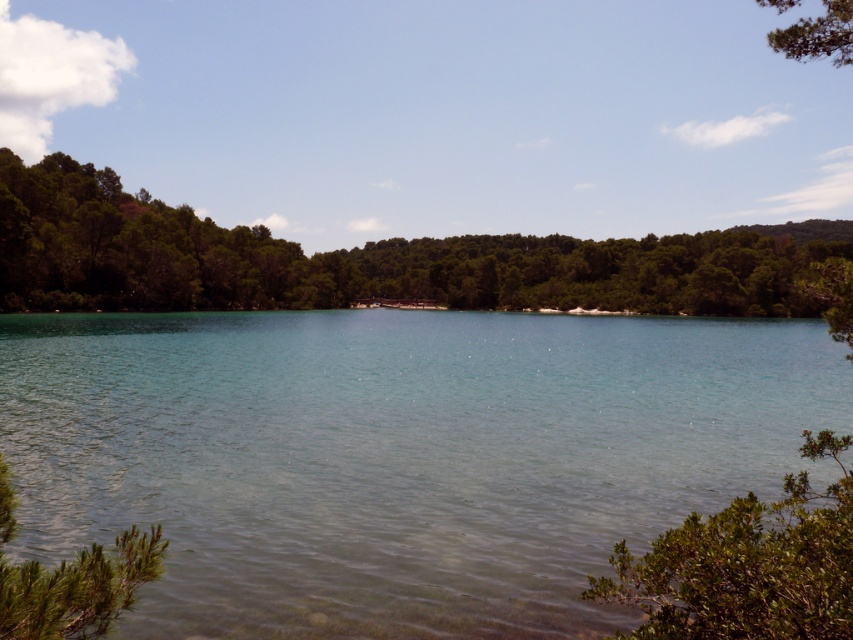
You are an environmental scientist analyzing the image. You need to determine which tree has a larger trunk diameter between the green leafy tree at left and the green textured tree at upper right. Which one would you choose?

The green textured tree at upper right has a larger trunk diameter since the green leafy tree at left is thinner than it.

Based on the scene description and the coordinates provided, what does the point at (397, 456) represent?

The point at (397, 456) indicates clear water at center.